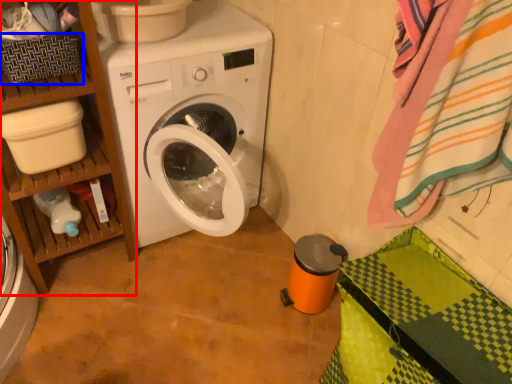
Question: Which of the following is the farthest to the observer, shelf (highlighted by a red box) or basket (highlighted by a blue box)?

Choices:
 (A) shelf
 (B) basket

Answer: (B)